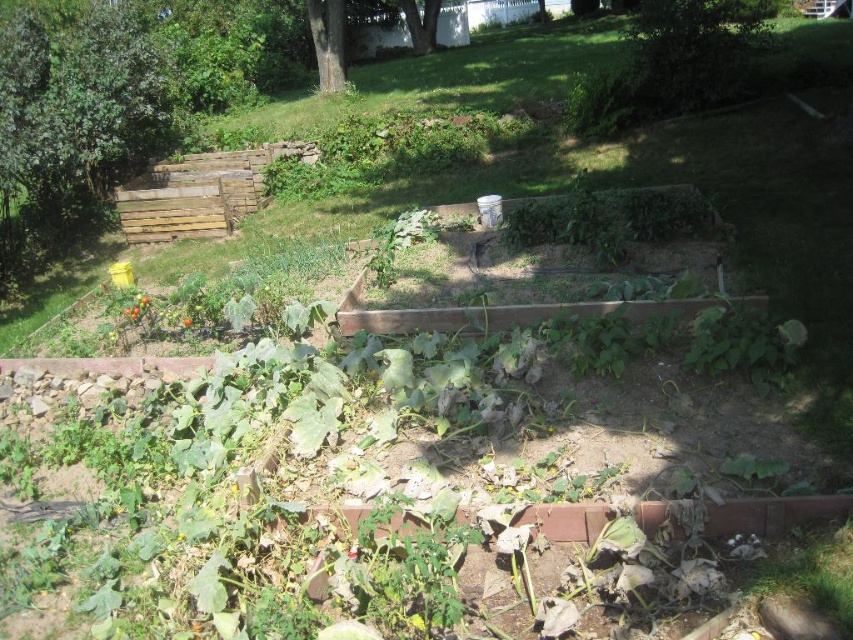
Between green rough bark tree at upper center and green leafy tree at upper center, which one is positioned lower?

green rough bark tree at upper center is below.

This screenshot has height=640, width=853. What do you see at coordinates (328, 42) in the screenshot?
I see `green rough bark tree at upper center` at bounding box center [328, 42].

Which is behind, point (321, 35) or point (416, 20)?

Positioned behind is point (416, 20).

Locate an element on the screen. The width and height of the screenshot is (853, 640). green rough bark tree at upper center is located at coordinates (328, 42).